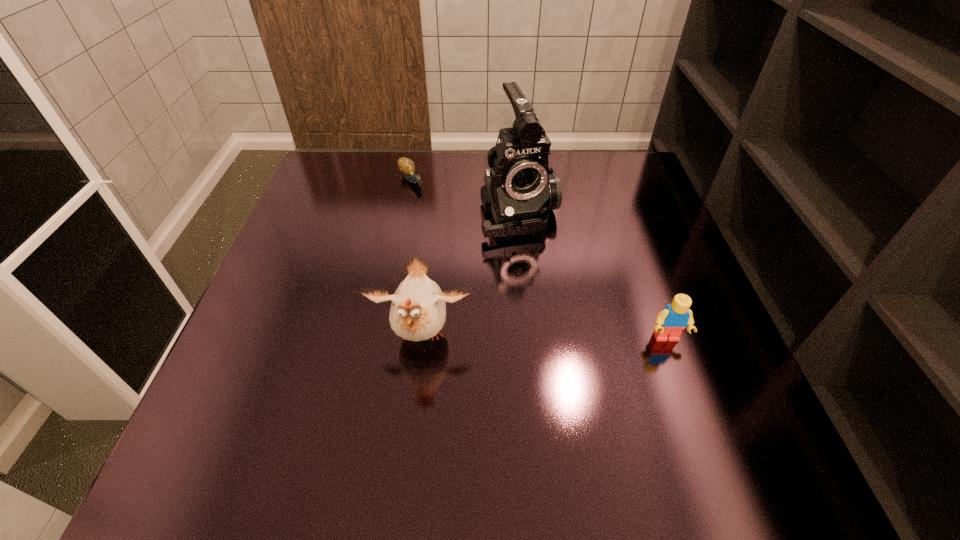
Locate an element on the screen. vacant region at the far left corner is located at coordinates click(x=330, y=155).

Image resolution: width=960 pixels, height=540 pixels. In the image, there is a desktop. Identify the location of vacant region at the far right corner. (636, 192).

In the image, there is a desktop. Where is `free space at the near right corner`? This screenshot has height=540, width=960. free space at the near right corner is located at coordinates (657, 393).

Where is `empty location between the camcorder and the Lego`? This screenshot has height=540, width=960. empty location between the camcorder and the Lego is located at coordinates (592, 275).

You are a GUI agent. You are given a task and a screenshot of the screen. Output one action in this format:
    pyautogui.click(x=<x>, y=<y>)
    Task: Click on the free space between the shortest object and the tallest object
    The height and width of the screenshot is (540, 960).
    Given the screenshot: What is the action you would take?
    pyautogui.click(x=466, y=197)

At what (x,y) coordinates should I click in order to perform the action: click on free space that is in between the tallest object and the Lego. Please return your answer as a coordinate pair (x, y). The width and height of the screenshot is (960, 540). Looking at the image, I should click on [592, 275].

I want to click on free point between the second tallest object and the camcorder, so click(470, 275).

Locate an element on the screen. empty space between the second tallest object and the second object from right to left is located at coordinates (470, 275).

You are a GUI agent. You are given a task and a screenshot of the screen. Output one action in this format:
    pyautogui.click(x=<x>, y=<y>)
    Task: Click on the empty location between the escargot and the third tallest object
    
    Given the screenshot: What is the action you would take?
    pyautogui.click(x=539, y=260)

Where is `empty space that is in between the bird and the Lego`? The image size is (960, 540). empty space that is in between the bird and the Lego is located at coordinates (543, 338).